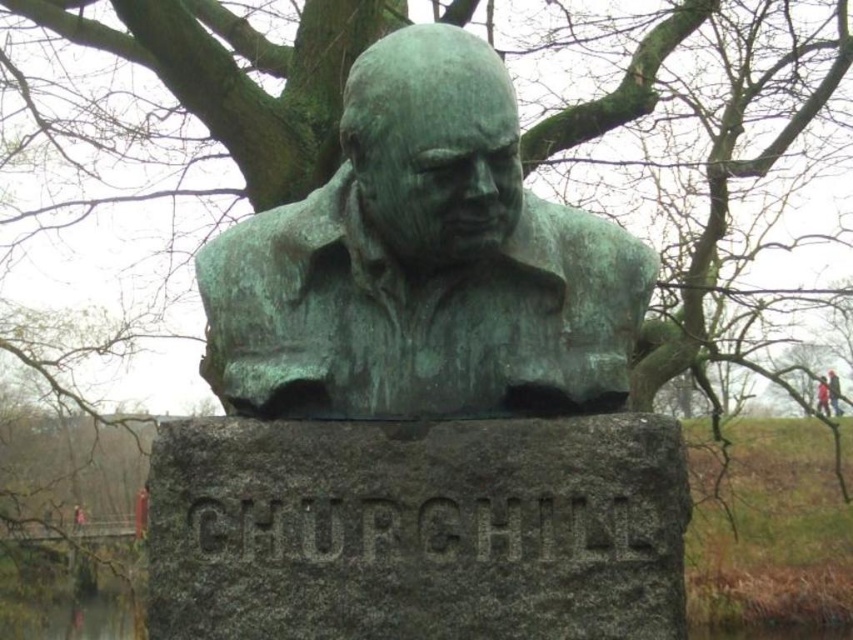
In the scene shown: You are an artist trying to sketch the scene. You notice the green patina bust at center and the red fabric person at upper right. Which object should you draw first if you want to capture the most prominent feature of the scene?

The green patina bust at center should be drawn first because it is much taller than the red fabric person at upper right, making it the most prominent feature in the scene.

You are an art student observing the bronze bust of Winston Churchill in the image. You notice the green patina bust at center and the red fabric person at upper right. Which object appears bigger in the image?

The green patina bust at center appears bigger than the red fabric person at upper right in the image.